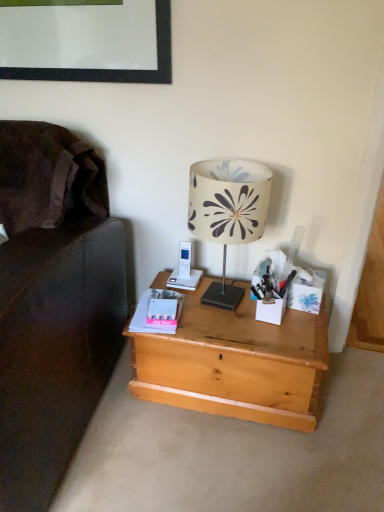
Question: Is matte pink paperback book at center-left thinner than natural wood desk at center?

Choices:
 (A) yes
 (B) no

Answer: (A)

Question: From a real-world perspective, is matte pink paperback book at center-left beneath natural wood desk at center?

Choices:
 (A) yes
 (B) no

Answer: (B)

Question: Is matte pink paperback book at center-left turned away from natural wood desk at center?

Choices:
 (A) yes
 (B) no

Answer: (B)

Question: Could you tell me if matte pink paperback book at center-left is facing natural wood desk at center?

Choices:
 (A) no
 (B) yes

Answer: (A)

Question: Are matte pink paperback book at center-left and natural wood desk at center making contact?

Choices:
 (A) yes
 (B) no

Answer: (B)

Question: Looking at their shapes, would you say natural wood desk at center is wider or thinner than white fabric lampshade at center?

Choices:
 (A) wide
 (B) thin

Answer: (A)

Question: Is natural wood desk at center bigger or smaller than white fabric lampshade at center?

Choices:
 (A) small
 (B) big

Answer: (B)

Question: Is natural wood desk at center in front of or behind white fabric lampshade at center in the image?

Choices:
 (A) behind
 (B) front

Answer: (A)

Question: In terms of height, does natural wood desk at center look taller or shorter compared to white fabric lampshade at center?

Choices:
 (A) short
 (B) tall

Answer: (A)

Question: Is matte pink paperback book at center-left inside the boundaries of white matte stationery at right, or outside?

Choices:
 (A) outside
 (B) inside

Answer: (A)

Question: From the image's perspective, is matte pink paperback book at center-left positioned above or below white matte stationery at right?

Choices:
 (A) above
 (B) below

Answer: (B)

Question: From a real-world perspective, is matte pink paperback book at center-left above or below white matte stationery at right?

Choices:
 (A) above
 (B) below

Answer: (B)

Question: Considering the positions of matte pink paperback book at center-left and white matte stationery at right in the image, is matte pink paperback book at center-left bigger or smaller than white matte stationery at right?

Choices:
 (A) big
 (B) small

Answer: (B)

Question: From the image's perspective, relative to white matte box at right, is matte pink paperback book at center-left above or below?

Choices:
 (A) above
 (B) below

Answer: (B)

Question: Is point (147, 293) positioned closer to the camera than point (311, 311)?

Choices:
 (A) farther
 (B) closer

Answer: (A)